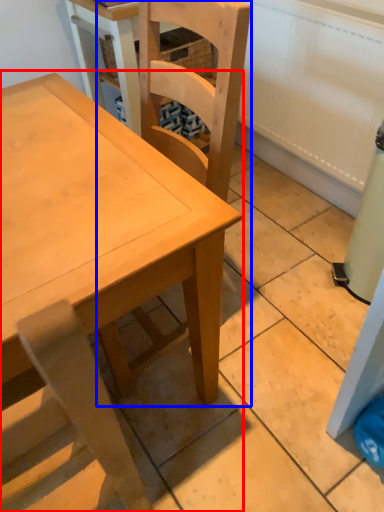
Question: Among these objects, which one is nearest to the camera, table (highlighted by a red box) or chair (highlighted by a blue box)?

Choices:
 (A) table
 (B) chair

Answer: (A)